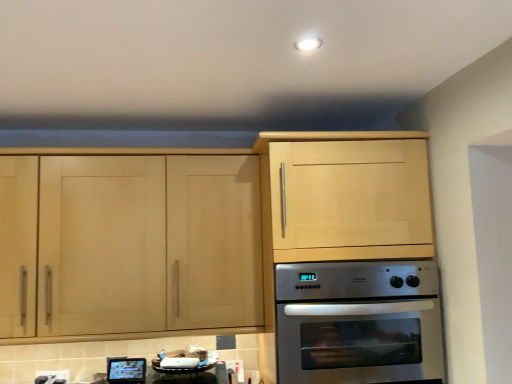
Measure the distance between white plastic electric outlet at lower left and camera.

6.20 feet.

This screenshot has height=384, width=512. Describe the element at coordinates (52, 377) in the screenshot. I see `white plastic electric outlet at lower left` at that location.

The width and height of the screenshot is (512, 384). Describe the element at coordinates (358, 322) in the screenshot. I see `stainless steel oven at lower center` at that location.

I want to click on light wood cabinet at left, so (199, 230).

How much distance is there between white plastic electric outlet at lower left and metallic silver tv at lower left?

white plastic electric outlet at lower left is 10.67 inches away from metallic silver tv at lower left.

Looking at their sizes, would you say white plastic electric outlet at lower left is wider or thinner than metallic silver tv at lower left?

In the image, white plastic electric outlet at lower left appears to be more narrow than metallic silver tv at lower left.

How different are the orientations of white plastic electric outlet at lower left and metallic silver tv at lower left in degrees?

They differ by 1.16 degrees in their facing directions.

Consider the image. Could you tell me if white plastic electric outlet at lower left is facing metallic silver tv at lower left?

No, white plastic electric outlet at lower left does not turn towards metallic silver tv at lower left.

Who is shorter, metallic silver tv at lower left or white plastic electric outlet at lower left?

white plastic electric outlet at lower left is shorter.

How different are the orientations of metallic silver tv at lower left and white plastic electric outlet at lower left in degrees?

The facing directions of metallic silver tv at lower left and white plastic electric outlet at lower left are 1.16 degrees apart.

Who is smaller, metallic silver tv at lower left or white plastic electric outlet at lower left?

white plastic electric outlet at lower left.

Relative to white plastic electric outlet at lower left, is light wood cabinet at left in front or behind?

Visually, light wood cabinet at left is located in front of white plastic electric outlet at lower left.

Which is more distant, (x=381, y=220) or (x=45, y=377)?

Positioned behind is point (x=45, y=377).

From the picture: Does light wood cabinet at left appear on the left side of white plastic electric outlet at lower left?

Incorrect, light wood cabinet at left is not on the left side of white plastic electric outlet at lower left.

From a real-world perspective, is light wood cabinet at left physically below white plastic electric outlet at lower left?

No, from a real-world perspective, light wood cabinet at left is not under white plastic electric outlet at lower left.

Which of these two, light wood cabinet at left or metallic silver tv at lower left, is bigger?

With larger size is light wood cabinet at left.

Would you say light wood cabinet at left is outside metallic silver tv at lower left?

Indeed, light wood cabinet at left is completely outside metallic silver tv at lower left.

Does point (198, 172) lie in front of point (118, 371)?

Yes.

Looking at this image, from the image's perspective, which is above, metallic silver tv at lower left or stainless steel oven at lower center?

stainless steel oven at lower center appears higher in the image.

Considering the relative sizes of metallic silver tv at lower left and stainless steel oven at lower center in the image provided, is metallic silver tv at lower left bigger than stainless steel oven at lower center?

Incorrect, metallic silver tv at lower left is not larger than stainless steel oven at lower center.

This screenshot has height=384, width=512. Find the location of `oven that appears in front of the metallic silver tv at lower left`. oven that appears in front of the metallic silver tv at lower left is located at coordinates (358, 322).

Is there a large distance between metallic silver tv at lower left and stainless steel oven at lower center?

No, metallic silver tv at lower left is in close proximity to stainless steel oven at lower center.

Considering the positions of points (19, 329) and (314, 332), is point (19, 329) closer to camera compared to point (314, 332)?

No.

Can you confirm if light wood cabinet at left is bigger than stainless steel oven at lower center?

Indeed, light wood cabinet at left has a larger size compared to stainless steel oven at lower center.

Is light wood cabinet at left not near stainless steel oven at lower center?

No, light wood cabinet at left is not far away from stainless steel oven at lower center.

From a real-world perspective, is light wood cabinet at left over stainless steel oven at lower center?

Yes.

The height and width of the screenshot is (384, 512). I want to click on cabinetry located above the white plastic electric outlet at lower left (from the image's perspective), so click(x=199, y=230).

Can you tell me how much white plastic electric outlet at lower left and light wood cabinet at left differ in facing direction?

There is a 0.0103-degree angle between the facing directions of white plastic electric outlet at lower left and light wood cabinet at left.

Is light wood cabinet at left completely or partially inside white plastic electric outlet at lower left?

That's incorrect, light wood cabinet at left is not inside white plastic electric outlet at lower left.

Is the depth of white plastic electric outlet at lower left greater than that of light wood cabinet at left?

Yes, white plastic electric outlet at lower left is further from the viewer.

Image resolution: width=512 pixels, height=384 pixels. I want to click on electric outlet on the left of metallic silver tv at lower left, so click(x=52, y=377).

In order to click on appliance on the right of white plastic electric outlet at lower left in this screenshot , I will do `click(126, 370)`.

Estimate the real-world distances between objects in this image. Which object is closer to stainless steel oven at lower center, metallic silver tv at lower left or light wood cabinet at left?

Among the two, light wood cabinet at left is located nearer to stainless steel oven at lower center.

Looking at the image, which one is located further to metallic silver tv at lower left, stainless steel oven at lower center or white plastic electric outlet at lower left?

stainless steel oven at lower center lies further to metallic silver tv at lower left than the other object.

Which object lies nearer to the anchor point stainless steel oven at lower center, metallic silver tv at lower left or white plastic electric outlet at lower left?

metallic silver tv at lower left is positioned closer to the anchor stainless steel oven at lower center.

Looking at the image, which one is located closer to light wood cabinet at left, stainless steel oven at lower center or metallic silver tv at lower left?

The object closer to light wood cabinet at left is stainless steel oven at lower center.

Looking at the image, which one is located further to white plastic electric outlet at lower left, stainless steel oven at lower center or light wood cabinet at left?

Based on the image, stainless steel oven at lower center appears to be further to white plastic electric outlet at lower left.

Which object lies nearer to the anchor point stainless steel oven at lower center, white plastic electric outlet at lower left or light wood cabinet at left?

light wood cabinet at left.

In the scene shown: Which object lies further to the anchor point light wood cabinet at left, metallic silver tv at lower left or white plastic electric outlet at lower left?

Based on the image, white plastic electric outlet at lower left appears to be further to light wood cabinet at left.

Which object lies nearer to the anchor point white plastic electric outlet at lower left, metallic silver tv at lower left or stainless steel oven at lower center?

The object closer to white plastic electric outlet at lower left is metallic silver tv at lower left.

In order to click on appliance located between white plastic electric outlet at lower left and stainless steel oven at lower center in the left-right direction in this screenshot , I will do `click(126, 370)`.

Where is `appliance located between light wood cabinet at left and stainless steel oven at lower center in the left-right direction`? This screenshot has width=512, height=384. appliance located between light wood cabinet at left and stainless steel oven at lower center in the left-right direction is located at coordinates (126, 370).

Where is `cabinetry between white plastic electric outlet at lower left and stainless steel oven at lower center in the horizontal direction`? Image resolution: width=512 pixels, height=384 pixels. cabinetry between white plastic electric outlet at lower left and stainless steel oven at lower center in the horizontal direction is located at coordinates [x=199, y=230].

In order to click on appliance between light wood cabinet at left and white plastic electric outlet at lower left from top to bottom in this screenshot , I will do `click(126, 370)`.